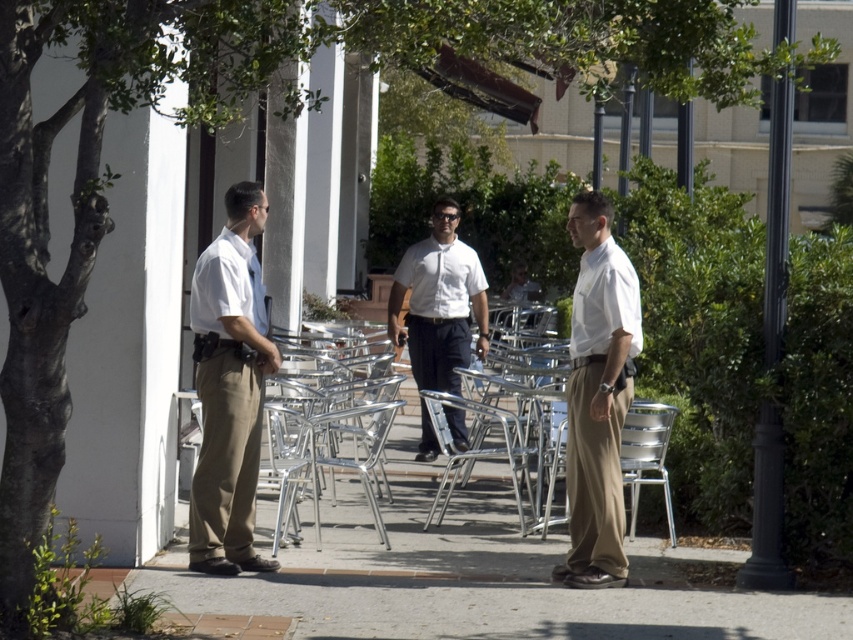
You are a delivery person who needs to place a heavy box on the ground. You see the smooth concrete pavement at center and the silver metallic chair at center. Which surface should you choose to place the box?

You should place the box on the smooth concrete pavement at center because it is located below the silver metallic chair at center, making it the appropriate surface for placing heavy items.

You are standing in the outdoor area and want to walk from point A to point B. Point A is at coordinates point (433, 218) and point B is at coordinates point (515, 436). Which point is closer to you when you start walking?

Point (433, 218) is closer to you because it is further to the viewer than point (515, 436), meaning it is nearer in your line of sight.

You are standing on the smooth concrete pavement at center. What are the coordinates of the point where you are standing?

The coordinates of the point where you are standing on the smooth concrete pavement at center are approximately 0.902 in the x direction and 0.556 in the y direction.